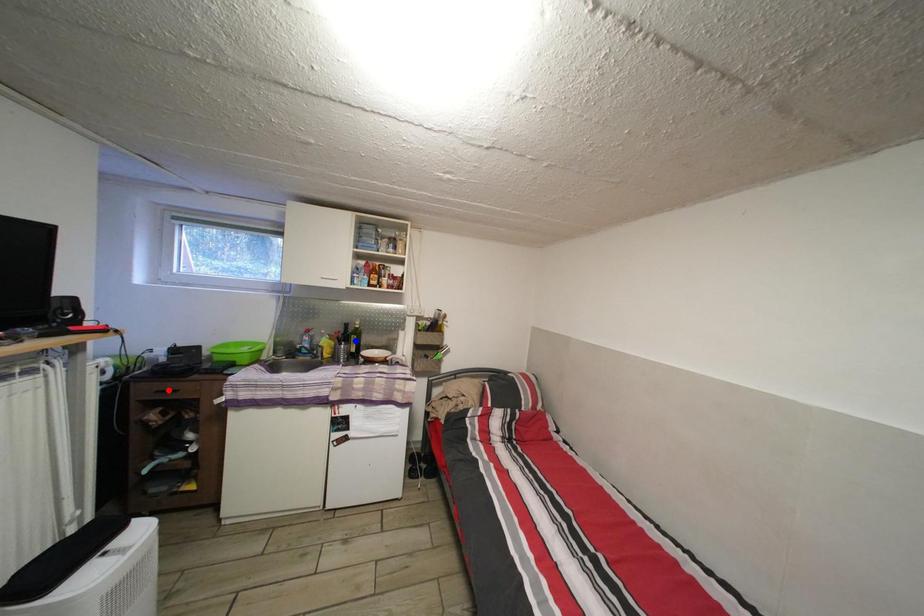
Question: Which of the two points in the image is closer to the camera?

Choices:
 (A) Blue point is closer.
 (B) Red point is closer.

Answer: (B)